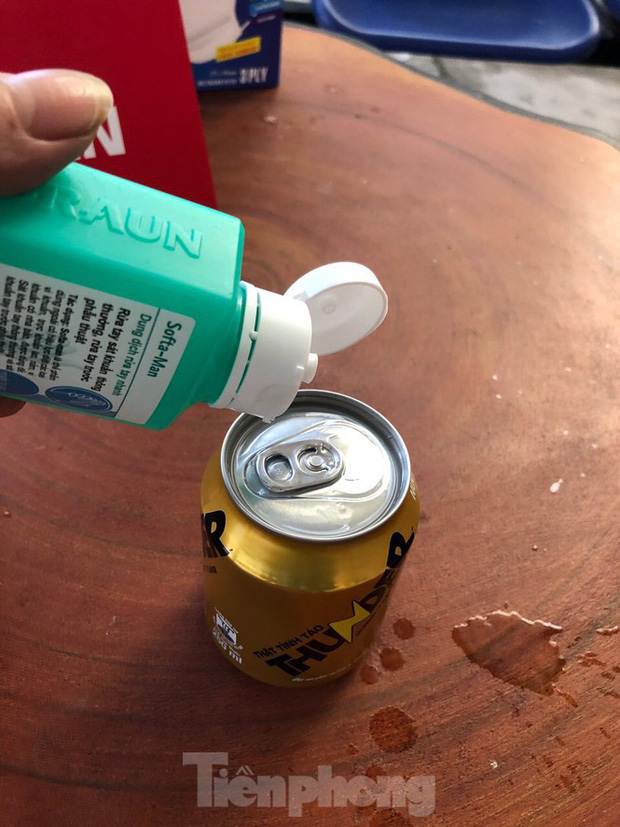
The height and width of the screenshot is (827, 620). Identify the location of green bottle. pos(167,278).